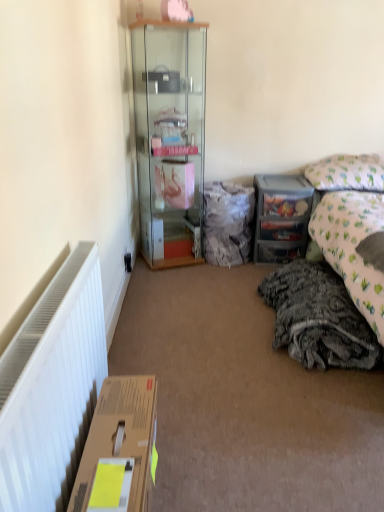
Describe the element at coordinates (347, 173) in the screenshot. I see `patterned fabric pillow at upper right` at that location.

What is the approximate width of brown cardboard box at lower left?

brown cardboard box at lower left is 8.46 inches wide.

You are a GUI agent. You are given a task and a screenshot of the screen. Output one action in this format:
    pyautogui.click(x=<x>, y=<y>)
    Task: Click on the fluffy gray blanket at right
    
    Given the screenshot: What is the action you would take?
    pyautogui.click(x=352, y=227)

The image size is (384, 512). What do you see at coordinates (170, 138) in the screenshot? I see `transparent glass cabinet at center` at bounding box center [170, 138].

Identify the location of gray textured blanket at lower right. (318, 318).

The height and width of the screenshot is (512, 384). Describe the element at coordinates (318, 318) in the screenshot. I see `gray textured blanket at lower right` at that location.

Consider the image. What is the approximate height of clear plastic drawers at center right?

clear plastic drawers at center right is 24.78 inches tall.

In order to face clear plastic drawers at center right, should I rotate leftwards or rightwards?

A 11.594 degree turn to the right will do.

What are the coordinates of `patterned fabric pillow at upper right` in the screenshot? It's located at click(x=347, y=173).

I want to click on bed that appears in front of the gray textured blanket at lower right, so click(x=352, y=227).

Considering the sizes of objects fluffy gray blanket at right and gray textured blanket at lower right in the image provided, who is shorter, fluffy gray blanket at right or gray textured blanket at lower right?

With less height is gray textured blanket at lower right.

Is fluffy gray blanket at right positioned with its back to gray textured blanket at lower right?

No, gray textured blanket at lower right is not at the back of fluffy gray blanket at right.

Is fluffy gray blanket at right to the right of gray textured blanket at lower right from the viewer's perspective?

Yes, fluffy gray blanket at right is to the right of gray textured blanket at lower right.

From the picture: From a real-world perspective, who is located lower, brown cardboard box at lower left or fuzzy fabric bag at center?

brown cardboard box at lower left.

Does brown cardboard box at lower left have a smaller size compared to fuzzy fabric bag at center?

→ Yes.

Is brown cardboard box at lower left situated inside fuzzy fabric bag at center or outside?

brown cardboard box at lower left is not inside fuzzy fabric bag at center, it's outside.

Considering the relative sizes of brown cardboard box at lower left and fuzzy fabric bag at center in the image provided, is brown cardboard box at lower left wider than fuzzy fabric bag at center?

No, brown cardboard box at lower left is not wider than fuzzy fabric bag at center.

In the scene shown: Is fluffy gray blanket at right located outside black plastic power outlet at lower left?

Yes, fluffy gray blanket at right is not within black plastic power outlet at lower left.

Looking at this image, is fluffy gray blanket at right touching black plastic power outlet at lower left?

No, fluffy gray blanket at right is not in contact with black plastic power outlet at lower left.

Relative to black plastic power outlet at lower left, is fluffy gray blanket at right in front or behind?

Clearly, fluffy gray blanket at right is in front of black plastic power outlet at lower left.

From a real-world perspective, is fluffy gray blanket at right positioned under black plastic power outlet at lower left based on gravity?

No, from a real-world perspective, fluffy gray blanket at right is not below black plastic power outlet at lower left.

In terms of width, does gray textured blanket at lower right look wider or thinner when compared to clear plastic drawers at center right?

In the image, gray textured blanket at lower right appears to be wider than clear plastic drawers at center right.

Does point (345, 341) come behind point (297, 208)?

No, (345, 341) is in front of (297, 208).

Considering the sizes of objects gray textured blanket at lower right and clear plastic drawers at center right in the image provided, who is smaller, gray textured blanket at lower right or clear plastic drawers at center right?

clear plastic drawers at center right.

The image size is (384, 512). I want to click on desk behind the gray textured blanket at lower right, so click(281, 217).

Between gray textured blanket at lower right and brown cardboard box at lower left, which one appears on the right side from the viewer's perspective?

gray textured blanket at lower right.

From the image's perspective, which is below, gray textured blanket at lower right or brown cardboard box at lower left?

brown cardboard box at lower left is shown below in the image.

Is gray textured blanket at lower right in contact with brown cardboard box at lower left?

No, gray textured blanket at lower right is not beside brown cardboard box at lower left.

Do you think gray textured blanket at lower right is within brown cardboard box at lower left, or outside of it?

gray textured blanket at lower right is located beyond the bounds of brown cardboard box at lower left.

Considering the relative positions of fuzzy fabric bag at center and fluffy gray blanket at right in the image provided, is fuzzy fabric bag at center to the right of fluffy gray blanket at right from the viewer's perspective?

No, fuzzy fabric bag at center is not to the right of fluffy gray blanket at right.

Is point (208, 188) closer to camera compared to point (354, 277)?

No, (208, 188) is further to viewer.

Is fuzzy fabric bag at center surrounding fluffy gray blanket at right?

No, fluffy gray blanket at right is not surrounded by fuzzy fabric bag at center.

Is fluffy gray blanket at right at the back of fuzzy fabric bag at center?

No, fuzzy fabric bag at center is not facing the opposite direction of fluffy gray blanket at right.

From the image's perspective, is brown cardboard box at lower left beneath patterned fabric pillow at upper right?

Yes, from the image's perspective, brown cardboard box at lower left is below patterned fabric pillow at upper right.

Which object is positioned more to the left, brown cardboard box at lower left or patterned fabric pillow at upper right?

brown cardboard box at lower left is more to the left.

Which is correct: brown cardboard box at lower left is inside patterned fabric pillow at upper right, or outside of it?

brown cardboard box at lower left is outside patterned fabric pillow at upper right.

This screenshot has height=512, width=384. What are the coordinates of `bed above the gray textured blanket at lower right (from the image's perspective)` in the screenshot? It's located at (352, 227).

Image resolution: width=384 pixels, height=512 pixels. Find the location of `box located in front of the fuzzy fabric bag at center`. box located in front of the fuzzy fabric bag at center is located at coordinates (119, 449).

Which object lies nearer to the anchor point fluffy gray blanket at right, brown cardboard box at lower left or transparent glass cabinet at center?

transparent glass cabinet at center is positioned closer to the anchor fluffy gray blanket at right.

When comparing their distances from brown cardboard box at lower left, does transparent glass cabinet at center or clear plastic drawers at center right seem further?

clear plastic drawers at center right lies further to brown cardboard box at lower left than the other object.

Considering their positions, is clear plastic drawers at center right positioned closer to gray textured blanket at lower right than transparent glass cabinet at center?

clear plastic drawers at center right is closer to gray textured blanket at lower right.

Looking at the image, which one is located closer to patterned fabric pillow at upper right, fluffy gray blanket at right or fuzzy fabric bag at center?

fluffy gray blanket at right is closer to patterned fabric pillow at upper right.

Considering their positions, is brown cardboard box at lower left positioned further to transparent glass cabinet at center than fuzzy fabric bag at center?

The object further to transparent glass cabinet at center is brown cardboard box at lower left.

When comparing their distances from black plastic power outlet at lower left, does transparent glass cabinet at center or brown cardboard box at lower left seem closer?

Among the two, transparent glass cabinet at center is located nearer to black plastic power outlet at lower left.

When comparing their distances from fuzzy fabric bag at center, does patterned fabric pillow at upper right or gray textured blanket at lower right seem closer?

patterned fabric pillow at upper right is positioned closer to the anchor fuzzy fabric bag at center.

Considering their positions, is fluffy gray blanket at right positioned further to fuzzy fabric bag at center than brown cardboard box at lower left?

The object further to fuzzy fabric bag at center is brown cardboard box at lower left.

The height and width of the screenshot is (512, 384). I want to click on material between transparent glass cabinet at center and brown cardboard box at lower left from top to bottom, so click(x=318, y=318).

Locate an element on the screen. pillow located between fluffy gray blanket at right and clear plastic drawers at center right in the depth direction is located at coordinates (347, 173).

Identify the location of desk located between transparent glass cabinet at center and patterned fabric pillow at upper right in the left-right direction. (281, 217).

At what (x,y) coordinates should I click in order to perform the action: click on material situated between brown cardboard box at lower left and fluffy gray blanket at right from left to right. Please return your answer as a coordinate pair (x, y). Looking at the image, I should click on (318, 318).